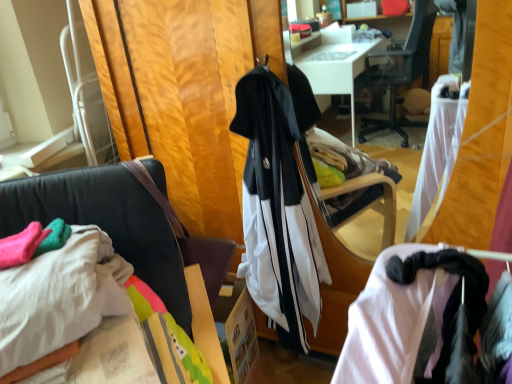
Identify the location of vacant region above white cotton sheet at lower left (from a real-world perspective). This screenshot has width=512, height=384. (39, 252).